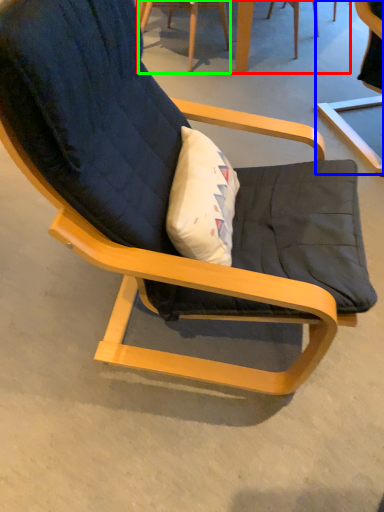
Question: Estimate the real-world distances between objects in this image. Which object is closer to table (highlighted by a red box), chair (highlighted by a blue box) or chair (highlighted by a green box)?

Choices:
 (A) chair
 (B) chair

Answer: (B)